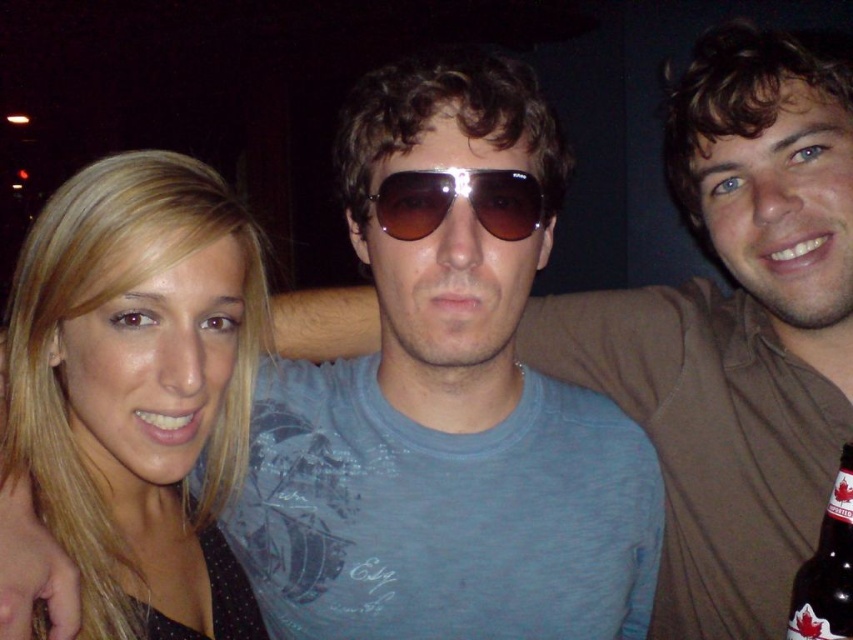
Between sunglasses at center and brown glass bottle at lower right, which one has more height?

Standing taller between the two is brown glass bottle at lower right.

Does sunglasses at center have a lesser height compared to brown glass bottle at lower right?

Yes.

Between point (540, 205) and point (814, 600), which one is positioned in front?

Point (540, 205) is more forward.

I want to click on sunglasses at center, so click(463, 196).

Which of these two, matte blue t-shirt at center or brown glass bottle at lower right, stands taller?

Standing taller between the two is matte blue t-shirt at center.

Image resolution: width=853 pixels, height=640 pixels. What do you see at coordinates (735, 332) in the screenshot? I see `matte blue t-shirt at center` at bounding box center [735, 332].

Who is more distant from viewer, (691, 605) or (817, 621)?

Point (691, 605)

Find the location of a particular element. matte blue t-shirt at center is located at coordinates (735, 332).

Is point (828, 131) farther from viewer compared to point (389, 202)?

Yes, point (828, 131) is farther from viewer.

Does matte blue t-shirt at center appear on the right side of sunglasses at center?

Correct, you'll find matte blue t-shirt at center to the right of sunglasses at center.

The height and width of the screenshot is (640, 853). Find the location of `matte blue t-shirt at center`. matte blue t-shirt at center is located at coordinates click(x=735, y=332).